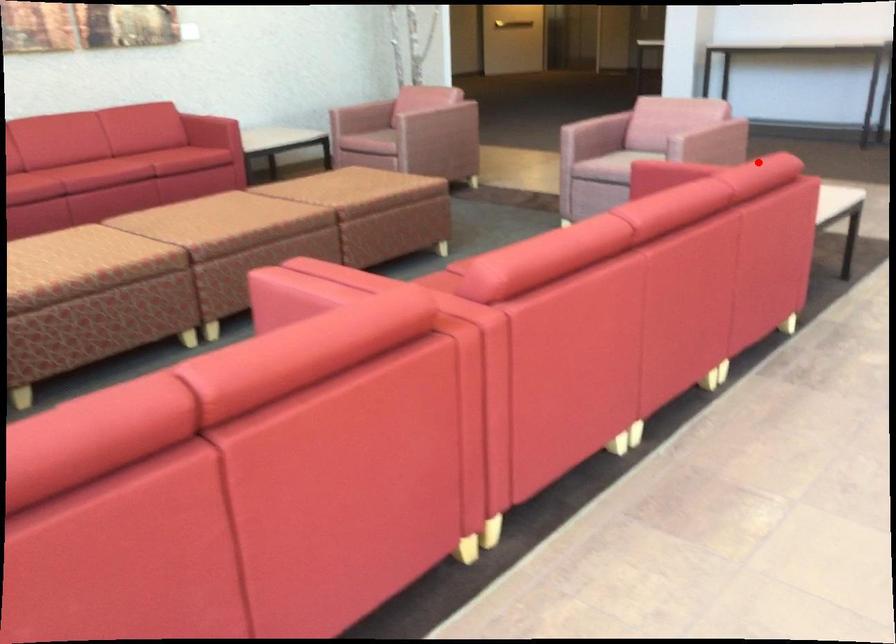
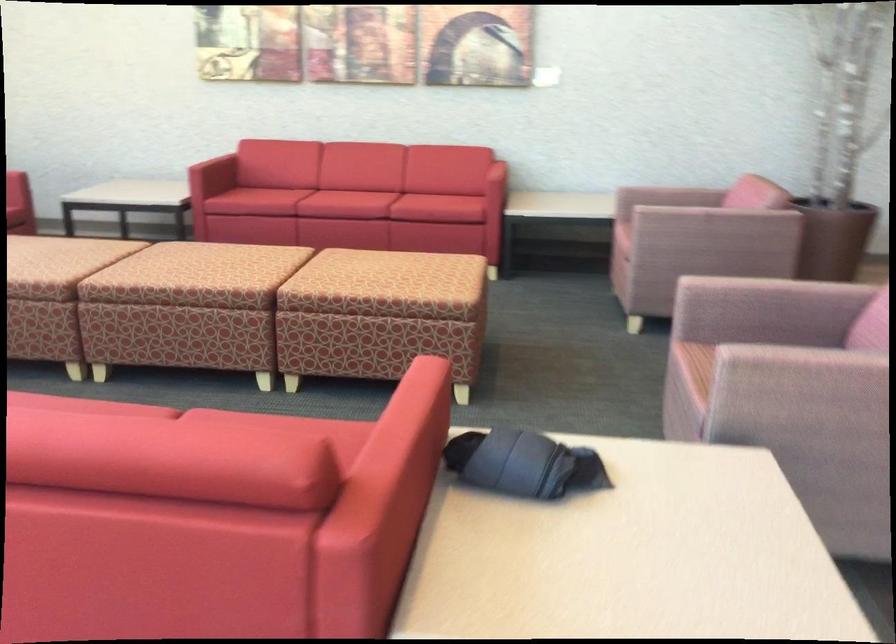
Question: I am providing you with two images of the same scene from different viewpoints. Given a red point in image1, look at the same physical point in image2. Is it:

Choices:
 (A) Closer to the viewpoint
 (B) Farther from the viewpoint

Answer: (A)